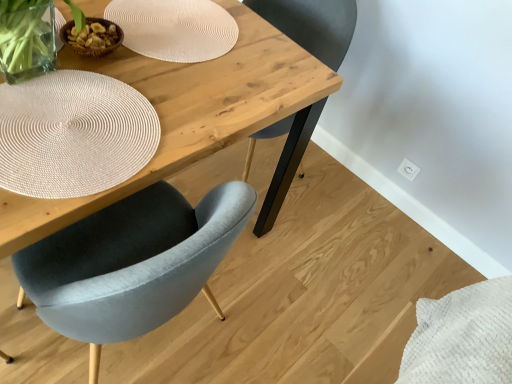
Find the location of `vacant area on top of white textured placemat at upper center, which is counted as the first paper plate, starting from the back (from a real-world perspective)`. vacant area on top of white textured placemat at upper center, which is counted as the first paper plate, starting from the back (from a real-world perspective) is located at coordinates pyautogui.click(x=174, y=16).